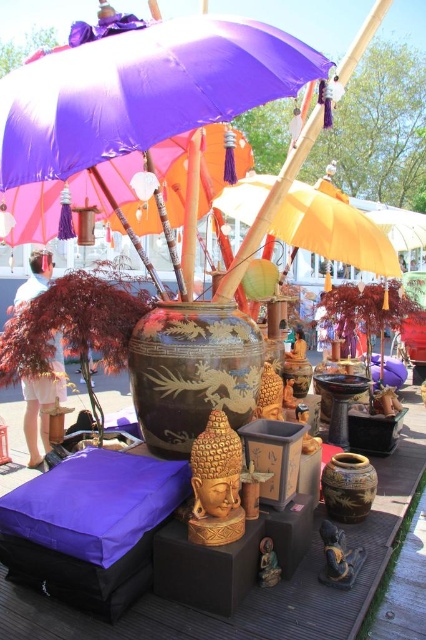
Question: Which object is the closest to the black glossy vase at center?

Choices:
 (A) purple fabric umbrella at upper center
 (B) brown textured vase at center

Answer: (B)

Question: Can you confirm if purple fabric umbrella at upper center is positioned above black glossy vase at center?

Choices:
 (A) yes
 (B) no

Answer: (A)

Question: Is purple fabric umbrella at upper center thinner than black glossy vase at center?

Choices:
 (A) yes
 (B) no

Answer: (B)

Question: Among these points, which one is nearest to the camera?

Choices:
 (A) (325, 467)
 (B) (222, 394)

Answer: (B)

Question: Can you confirm if purple fabric umbrella at upper center is bigger than brown textured vase at center?

Choices:
 (A) yes
 (B) no

Answer: (A)

Question: Which point appears closest to the camera in this image?

Choices:
 (A) (176, 442)
 (B) (60, 172)
 (C) (336, 465)

Answer: (B)